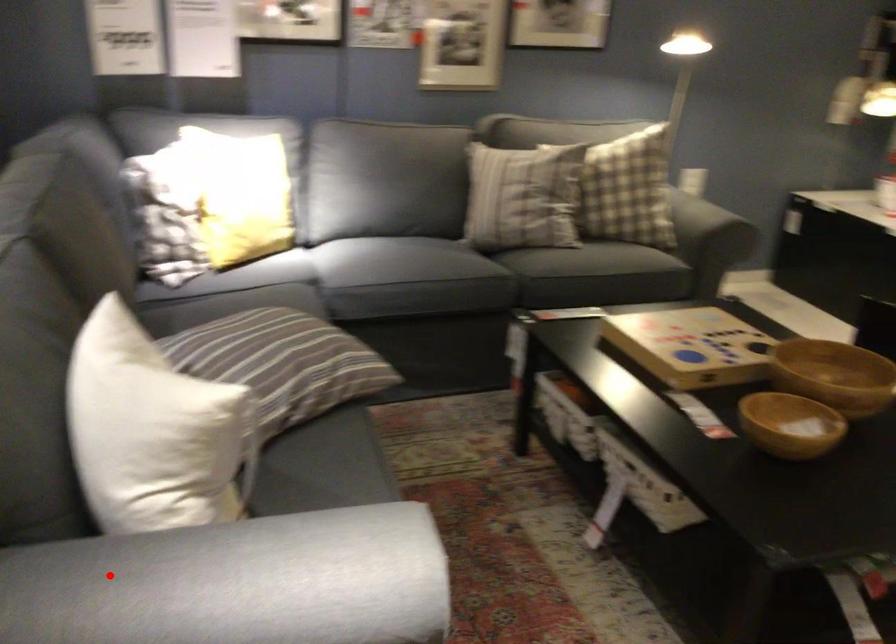
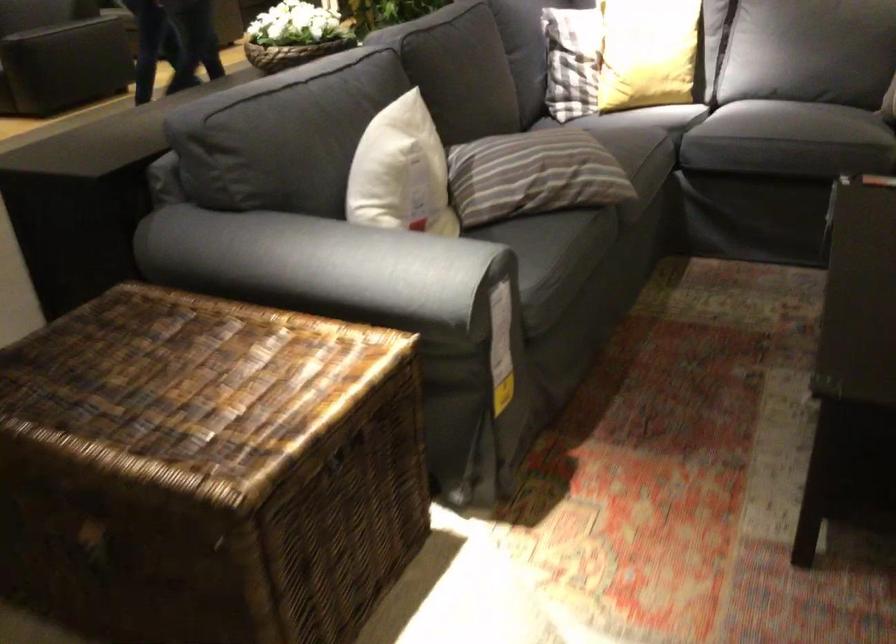
In the second image, find the point that corresponds to the highlighted location in the first image.

(304, 265)